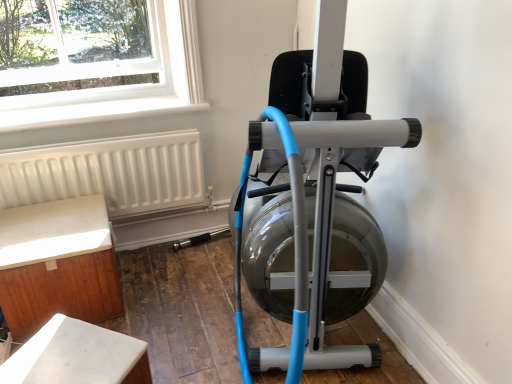
Where is `vacant point above white wood cabinet at lower left, which is the second furniture from front to back (from a real-world perspective)`? The width and height of the screenshot is (512, 384). vacant point above white wood cabinet at lower left, which is the second furniture from front to back (from a real-world perspective) is located at coordinates (42, 230).